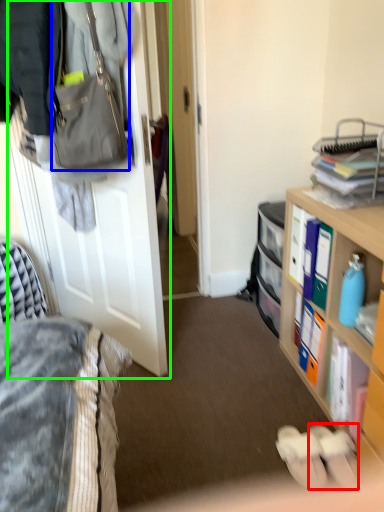
Question: Which object is the farthest from footwear (highlighted by a red box)? Choose among these: handbag (highlighted by a blue box) or door (highlighted by a green box).

Choices:
 (A) handbag
 (B) door

Answer: (A)